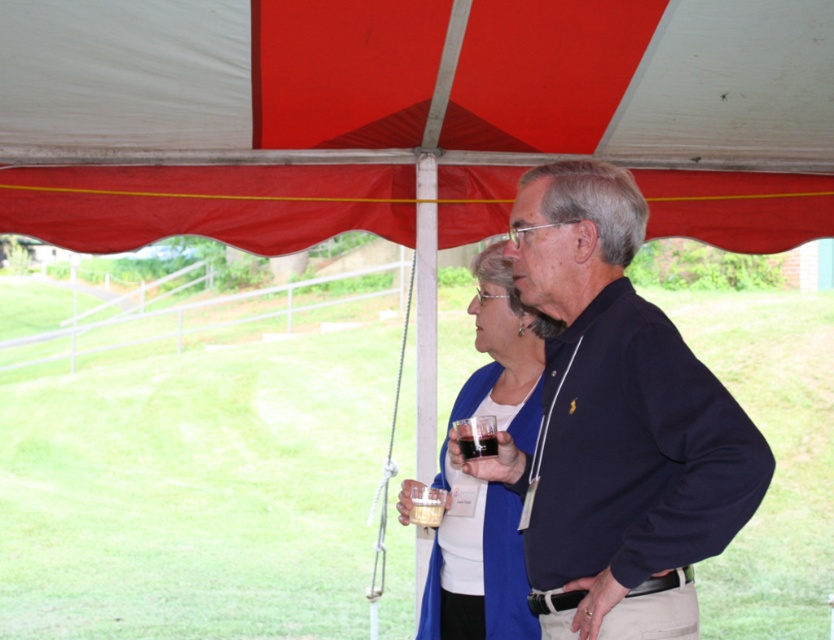
Question: Does translucent glass at upper center lie behind translucent plastic cup at lower center?

Choices:
 (A) no
 (B) yes

Answer: (A)

Question: Estimate the real-world distances between objects in this image. Which object is farther from the translucent glass at upper center?

Choices:
 (A) blue fabric sweater at center
 (B) translucent plastic cup at lower center
 (C) red fabric canopy at upper center
 (D) dark blue sweater at center

Answer: (C)

Question: Which of the following is the farthest from the observer?

Choices:
 (A) red fabric canopy at upper center
 (B) translucent plastic cup at lower center

Answer: (A)

Question: Can you confirm if blue fabric sweater at center is thinner than translucent plastic cup at lower center?

Choices:
 (A) yes
 (B) no

Answer: (B)

Question: Which object is farther from the camera taking this photo?

Choices:
 (A) translucent plastic cup at lower center
 (B) red fabric canopy at upper center
 (C) translucent glass at upper center

Answer: (B)

Question: Does blue fabric sweater at center have a smaller size compared to translucent plastic cup at lower center?

Choices:
 (A) yes
 (B) no

Answer: (B)